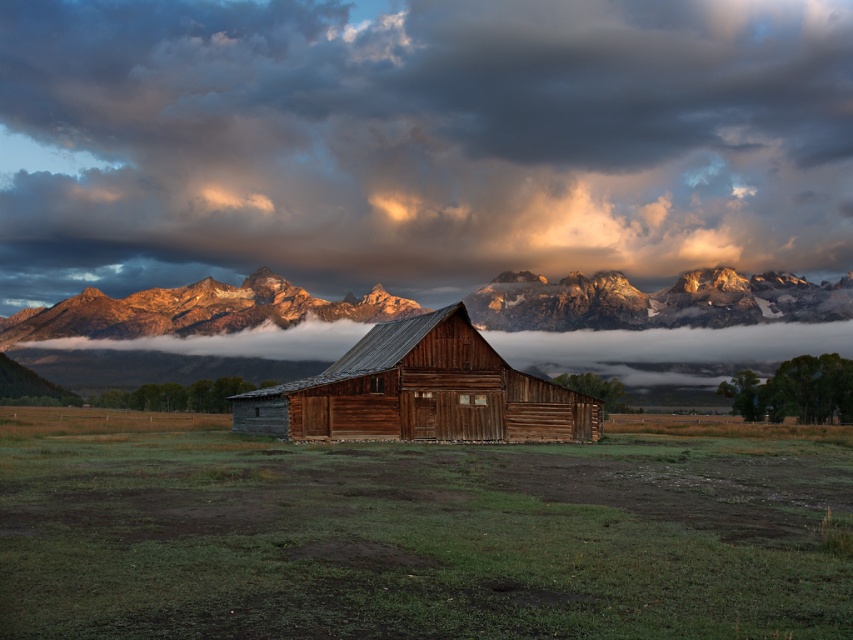
Question: Based on their relative distances, which object is nearer to the cloudy sky at upper center?

Choices:
 (A) wooden barn at center
 (B) rugged stone mountains at upper center

Answer: (B)

Question: Which of the following is the closest to the observer?

Choices:
 (A) (328, 125)
 (B) (65, 349)
 (C) (49, 563)

Answer: (C)

Question: Is cloudy sky at upper center to the left of rugged stone mountains at upper center from the viewer's perspective?

Choices:
 (A) yes
 (B) no

Answer: (A)

Question: Is cloudy sky at upper center thinner than green grassy field at center?

Choices:
 (A) yes
 (B) no

Answer: (B)

Question: Estimate the real-world distances between objects in this image. Which object is farther from the wooden barn at center?

Choices:
 (A) cloudy sky at upper center
 (B) green grassy field at center
 (C) rugged stone mountains at upper center

Answer: (A)

Question: Considering the relative positions of cloudy sky at upper center and wooden barn at center in the image provided, where is cloudy sky at upper center located with respect to wooden barn at center?

Choices:
 (A) left
 (B) right

Answer: (B)